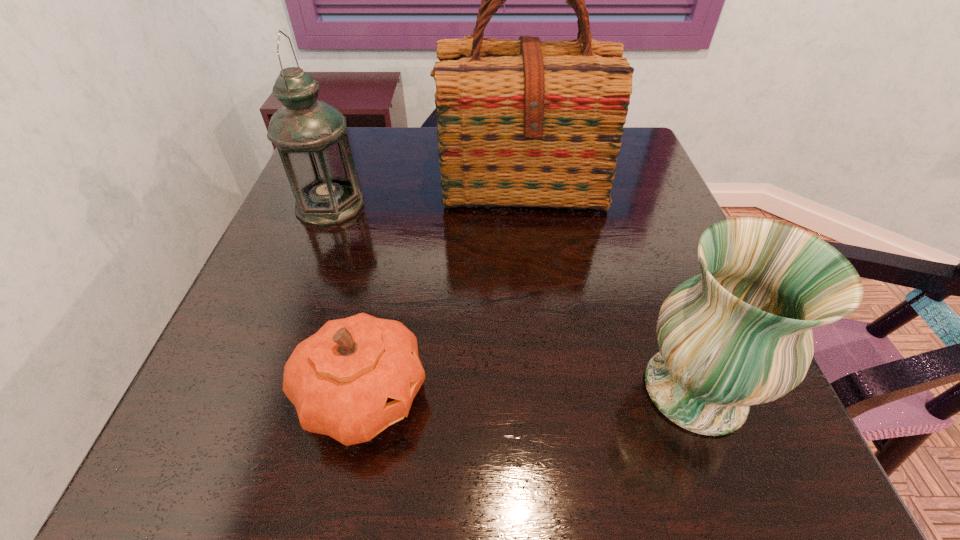
Where is `empty space between the oil lamp and the third tallest object`? empty space between the oil lamp and the third tallest object is located at coordinates (513, 298).

Locate an element on the screen. The width and height of the screenshot is (960, 540). free space between the oil lamp and the vase is located at coordinates (513, 298).

Find the location of a particular element. The height and width of the screenshot is (540, 960). object that stands as the third closest to the tallest object is located at coordinates (354, 377).

You are a GUI agent. You are given a task and a screenshot of the screen. Output one action in this format:
    pyautogui.click(x=<x>, y=<y>)
    Task: Click on the object that is the closest one to the vase
    
    Given the screenshot: What is the action you would take?
    pyautogui.click(x=354, y=377)

The width and height of the screenshot is (960, 540). Identify the location of vacant point that satisfies the following two spatial constraints: 1. on the open handle side of the shopping bag; 2. on the front-facing side of the pumpkin. (x=545, y=395).

This screenshot has height=540, width=960. I want to click on vacant space that satisfies the following two spatial constraints: 1. on the open handle side of the shopping bag; 2. on the front-facing side of the shortest object, so click(x=545, y=395).

In order to click on free location that satisfies the following two spatial constraints: 1. on the front side of the vase; 2. on the front-facing side of the shortest object in this screenshot , I will do `click(697, 395)`.

At what (x,y) coordinates should I click in order to perform the action: click on vacant space that satisfies the following two spatial constraints: 1. on the open handle side of the tallest object; 2. on the front-facing side of the pumpkin. Please return your answer as a coordinate pair (x, y). The width and height of the screenshot is (960, 540). Looking at the image, I should click on (545, 395).